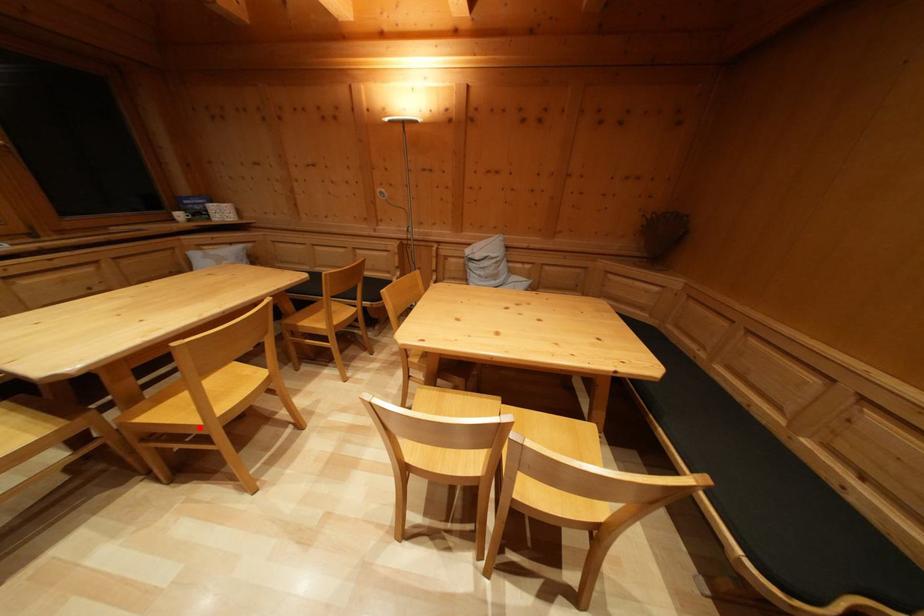
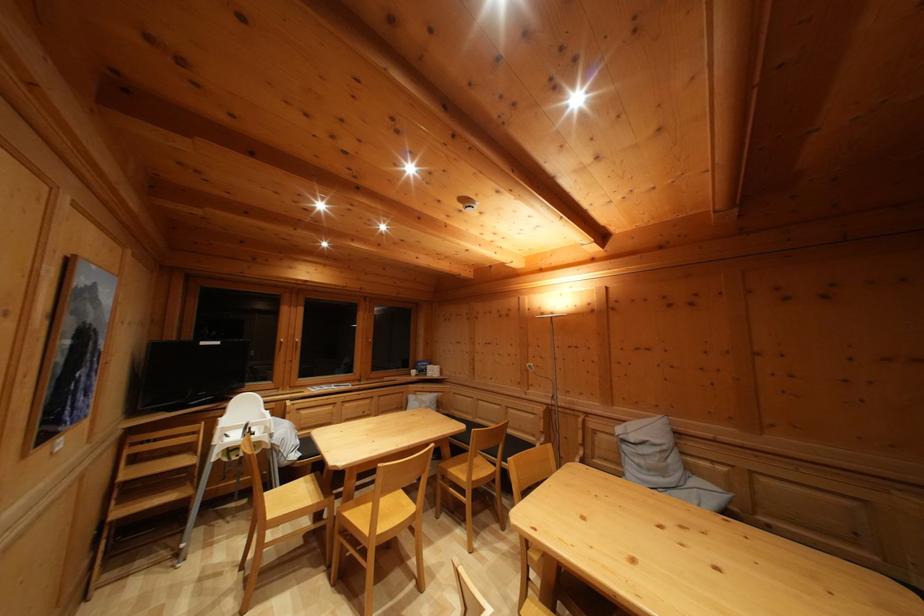
In the second image, find the point that corresponds to the highlighted location in the first image.

(371, 537)